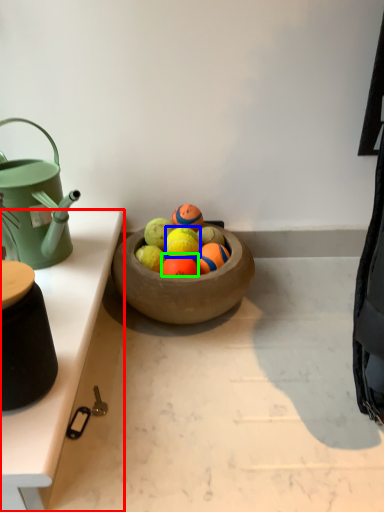
Question: Which is farther away from table (highlighted by a red box)? fruit (highlighted by a blue box) or fruit (highlighted by a green box)?

Choices:
 (A) fruit
 (B) fruit

Answer: (A)